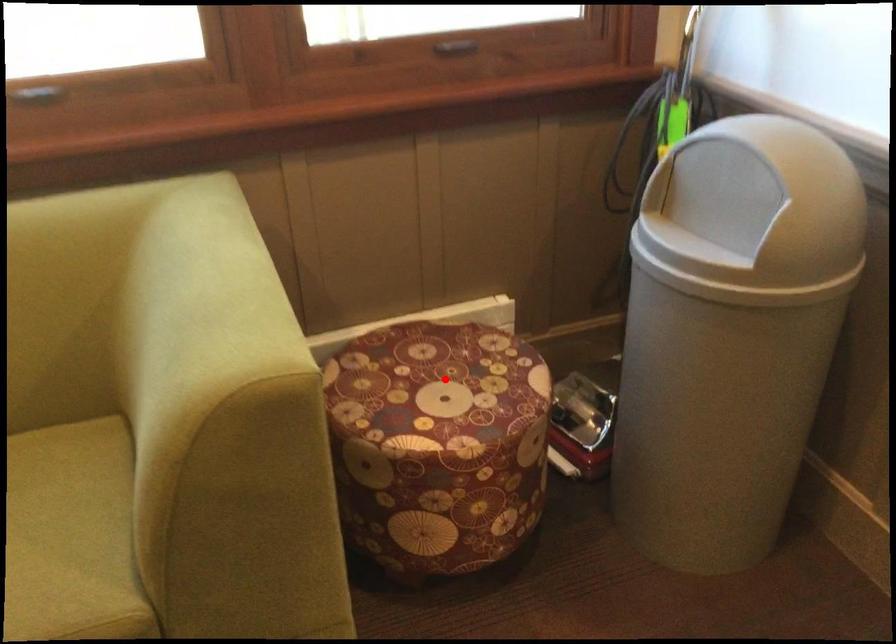
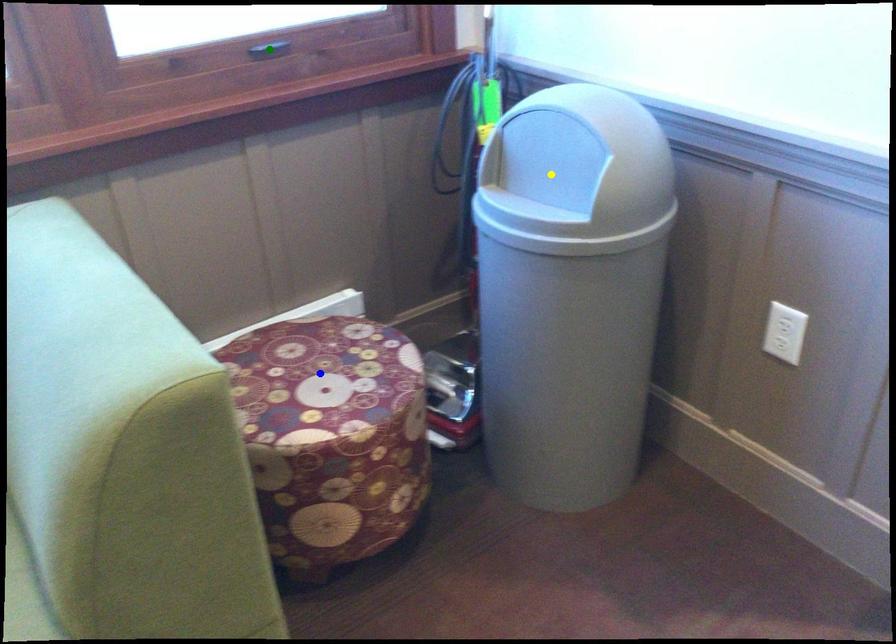
Question: I am providing you with two images of the same scene from different viewpoints. A red point is marked on the first image. You are given multiple points on the second image. Can you choose the point in image 2 that corresponds to the point in image 1?

Choices:
 (A) yellow point
 (B) green point
 (C) blue point

Answer: (C)